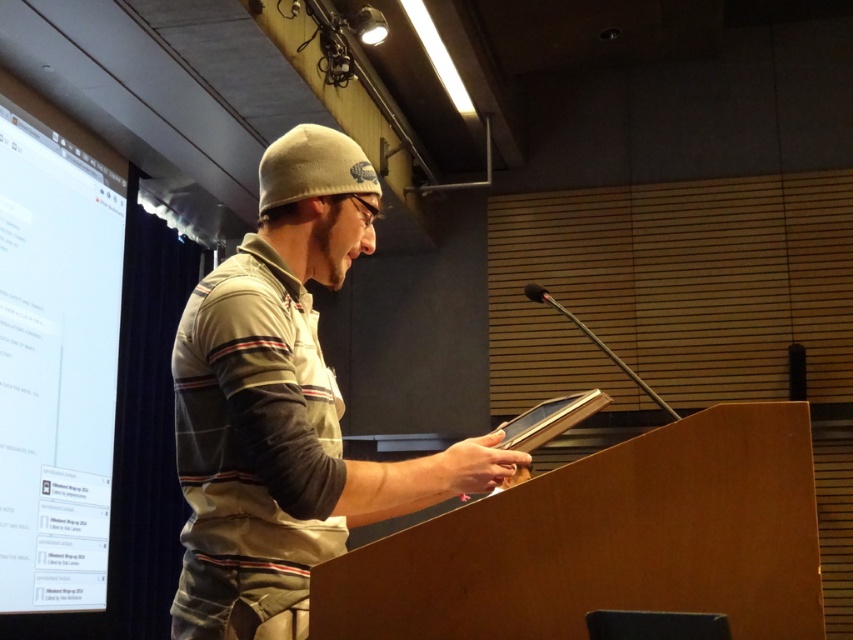
You are an event organizer setting up a stage for a presentation. You need to ensure that the khaki cotton beanie at center and the white glossy projection screen at left are positioned so that neither blocks the other from the audience view. Based on their sizes, which object should be placed higher to avoid obstruction?

The khaki cotton beanie at center might be wider than the white glossy projection screen at left, so to avoid obstruction, the khaki cotton beanie at center should be placed higher since it is wider and could block the view of the screen if positioned lower.

Consider the image. You are sitting in the front row of the conference room and notice two points marked in the image. The first point is at coordinates point (236, 627) and the second point is at point (22, 342). Which point is closer to you?

Point (236, 627) is closer to the viewer than point (22, 342).

You are organizing a costume party and need to decide which item will fit better into a small prop box. Based on the image, which item is wider between the khaki cotton beanie at center and the beige cotton polo shirt at center?

The khaki cotton beanie at center is wider than the beige cotton polo shirt at center, so it will take up more space in the prop box.